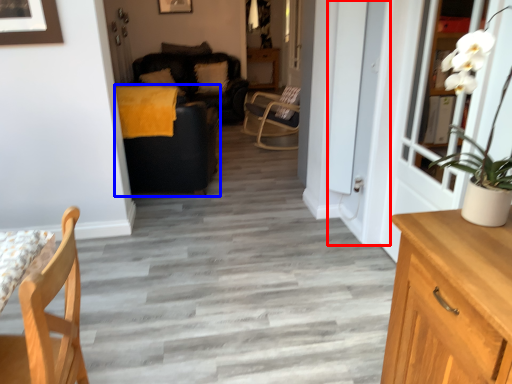
Question: Which object appears farthest to the camera in this image, screen door (highlighted by a red box) or studio couch (highlighted by a blue box)?

Choices:
 (A) screen door
 (B) studio couch

Answer: (B)